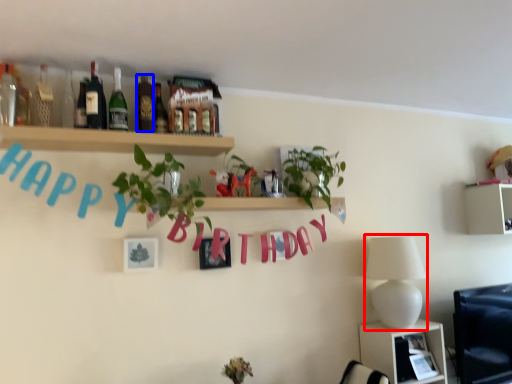
Question: Which point is closer to the camera, lamp (highlighted by a red box) or bottle (highlighted by a blue box)?

Choices:
 (A) lamp
 (B) bottle

Answer: (B)